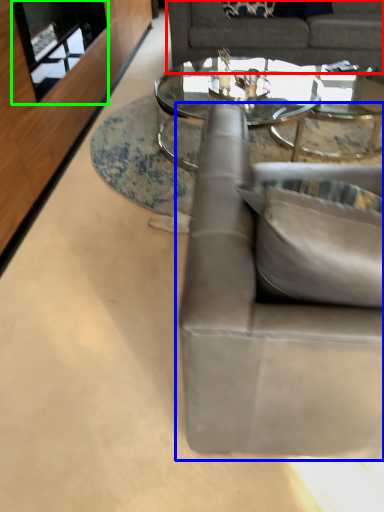
Question: Considering the real-world distances, which object is farthest from studio couch (highlighted by a red box)? studio couch (highlighted by a blue box) or glass door (highlighted by a green box)?

Choices:
 (A) studio couch
 (B) glass door

Answer: (A)